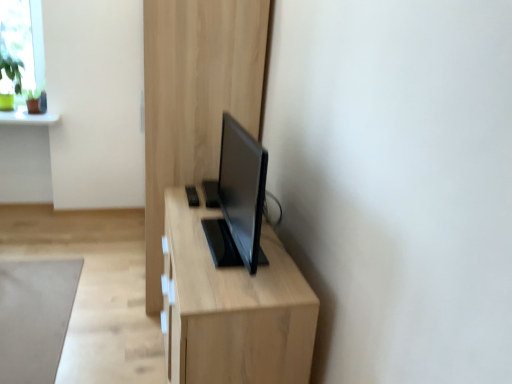
Question: Considering the relative sizes of gray matte rug at lower left and light wood dresser at center in the image provided, is gray matte rug at lower left shorter than light wood dresser at center?

Choices:
 (A) yes
 (B) no

Answer: (A)

Question: Is gray matte rug at lower left turned away from light wood dresser at center?

Choices:
 (A) no
 (B) yes

Answer: (A)

Question: Is gray matte rug at lower left thinner than light wood dresser at center?

Choices:
 (A) yes
 (B) no

Answer: (B)

Question: Is gray matte rug at lower left oriented towards light wood dresser at center?

Choices:
 (A) yes
 (B) no

Answer: (B)

Question: Does gray matte rug at lower left have a larger size compared to light wood dresser at center?

Choices:
 (A) no
 (B) yes

Answer: (A)

Question: In terms of width, does light wood dresser at center look wider or thinner when compared to gray matte rug at lower left?

Choices:
 (A) wide
 (B) thin

Answer: (B)

Question: From the image's perspective, relative to gray matte rug at lower left, is light wood dresser at center above or below?

Choices:
 (A) above
 (B) below

Answer: (A)

Question: In terms of size, does light wood dresser at center appear bigger or smaller than gray matte rug at lower left?

Choices:
 (A) small
 (B) big

Answer: (B)

Question: From their relative heights in the image, would you say light wood dresser at center is taller or shorter than gray matte rug at lower left?

Choices:
 (A) tall
 (B) short

Answer: (A)

Question: Considering the positions of light wood table at center and gray matte rug at lower left in the image, is light wood table at center taller or shorter than gray matte rug at lower left?

Choices:
 (A) short
 (B) tall

Answer: (B)

Question: Is light wood table at center in front of or behind gray matte rug at lower left in the image?

Choices:
 (A) behind
 (B) front

Answer: (B)

Question: From a real-world perspective, is light wood table at center positioned above or below gray matte rug at lower left?

Choices:
 (A) below
 (B) above

Answer: (B)

Question: Would you say light wood table at center is to the left or to the right of gray matte rug at lower left in the picture?

Choices:
 (A) left
 (B) right

Answer: (B)

Question: Would you say light wood dresser at center is to the left or to the right of light wood table at center in the picture?

Choices:
 (A) left
 (B) right

Answer: (A)

Question: Considering the positions of light wood dresser at center and light wood table at center in the image, is light wood dresser at center taller or shorter than light wood table at center?

Choices:
 (A) short
 (B) tall

Answer: (B)